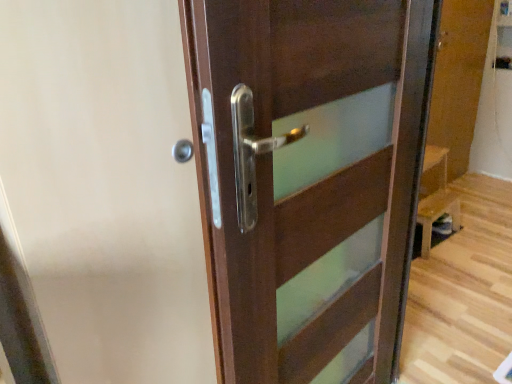
Question: Is matte wood screen door at center completely or partially outside of dark wood door at center?

Choices:
 (A) no
 (B) yes

Answer: (B)

Question: Can you confirm if matte wood screen door at center is taller than dark wood door at center?

Choices:
 (A) no
 (B) yes

Answer: (B)

Question: From a real-world perspective, is matte wood screen door at center physically above dark wood door at center?

Choices:
 (A) no
 (B) yes

Answer: (B)

Question: From the image's perspective, does matte wood screen door at center appear higher than dark wood door at center?

Choices:
 (A) yes
 (B) no

Answer: (A)

Question: Is matte wood screen door at center aimed at dark wood door at center?

Choices:
 (A) yes
 (B) no

Answer: (A)

Question: From a real-world perspective, is matte wood screen door at center under dark wood door at center?

Choices:
 (A) no
 (B) yes

Answer: (A)

Question: From the image's perspective, is dark wood door at center located beneath matte wood screen door at center?

Choices:
 (A) no
 (B) yes

Answer: (B)

Question: Considering the relative sizes of dark wood door at center and matte wood screen door at center in the image provided, is dark wood door at center bigger than matte wood screen door at center?

Choices:
 (A) no
 (B) yes

Answer: (A)

Question: Can you confirm if dark wood door at center is smaller than matte wood screen door at center?

Choices:
 (A) yes
 (B) no

Answer: (A)

Question: Is dark wood door at center oriented towards matte wood screen door at center?

Choices:
 (A) no
 (B) yes

Answer: (A)

Question: Is dark wood door at center oriented away from matte wood screen door at center?

Choices:
 (A) yes
 (B) no

Answer: (B)

Question: Considering the relative sizes of dark wood door at center and matte wood screen door at center in the image provided, is dark wood door at center thinner than matte wood screen door at center?

Choices:
 (A) no
 (B) yes

Answer: (A)

Question: In the image, is dark wood door at center positioned in front of or behind matte wood screen door at center?

Choices:
 (A) front
 (B) behind

Answer: (A)